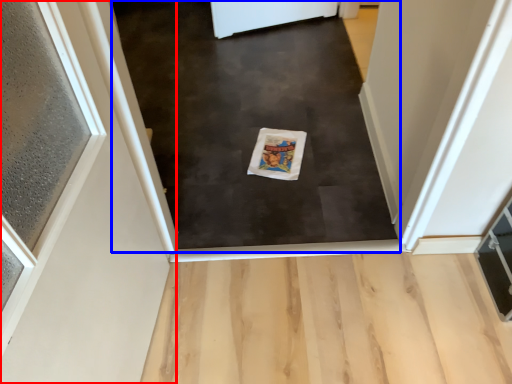
Question: Which object is closer to the camera taking this photo, door (highlighted by a red box) or mat (highlighted by a blue box)?

Choices:
 (A) door
 (B) mat

Answer: (A)